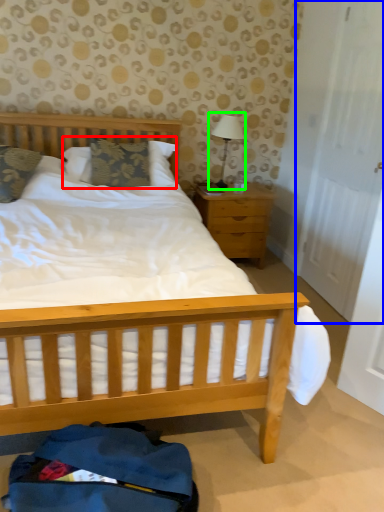
Question: Which is farther away from pillow (highlighted by a red box)? door (highlighted by a blue box) or table lamp (highlighted by a green box)?

Choices:
 (A) door
 (B) table lamp

Answer: (A)